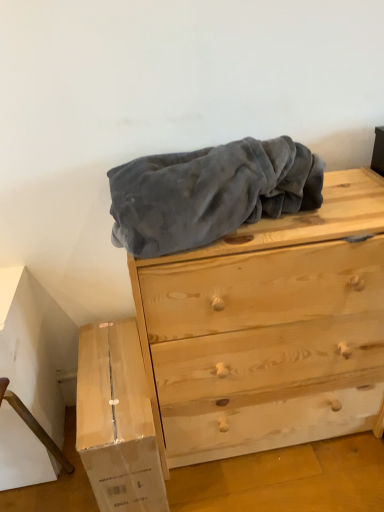
You are a GUI agent. You are given a task and a screenshot of the screen. Output one action in this format:
    pyautogui.click(x=<x>, y=<y>)
    Task: Click on the vacant space that's between light brown wood chest of drawers at center and white cardboard box at lower left
    
    Given the screenshot: What is the action you would take?
    pyautogui.click(x=256, y=488)